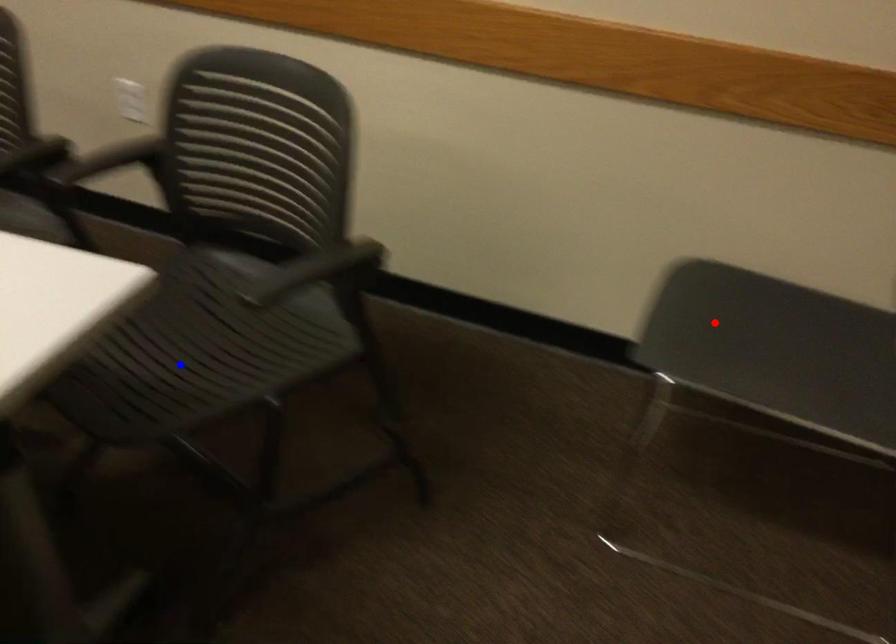
Question: Which of the two points in the image is closer to the camera?

Choices:
 (A) Blue point is closer.
 (B) Red point is closer.

Answer: (A)